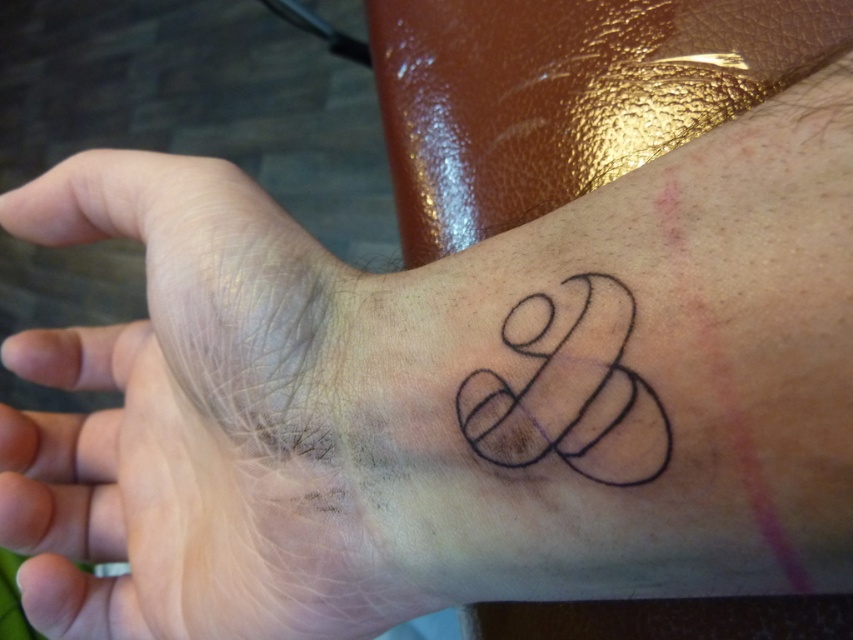
Question: Is skin/hair at lower left positioned before black ink tattoo at wrist?

Choices:
 (A) no
 (B) yes

Answer: (A)

Question: Can you confirm if skin/hair at lower left is positioned below black ink tattoo at wrist?

Choices:
 (A) no
 (B) yes

Answer: (B)

Question: Which point is farther to the camera?

Choices:
 (A) skin/hair at lower left
 (B) black ink tattoo at wrist

Answer: (A)

Question: In this image, where is skin/hair at lower left located relative to black ink tattoo at wrist?

Choices:
 (A) left
 (B) right

Answer: (A)

Question: Which object appears closest to the camera in this image?

Choices:
 (A) skin/hair at lower left
 (B) black ink tattoo at wrist

Answer: (B)